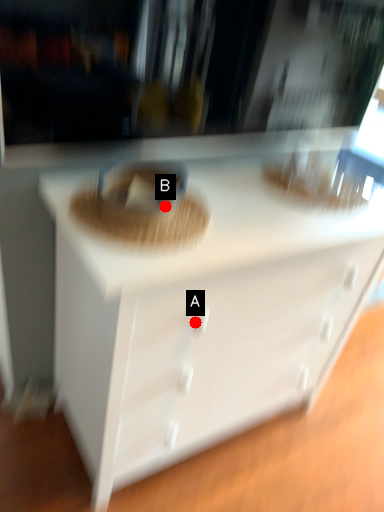
Question: Two points are circled on the image, labeled by A and B beside each circle. Which of the following is the closest to the observer?

Choices:
 (A) A is closer
 (B) B is closer

Answer: (A)